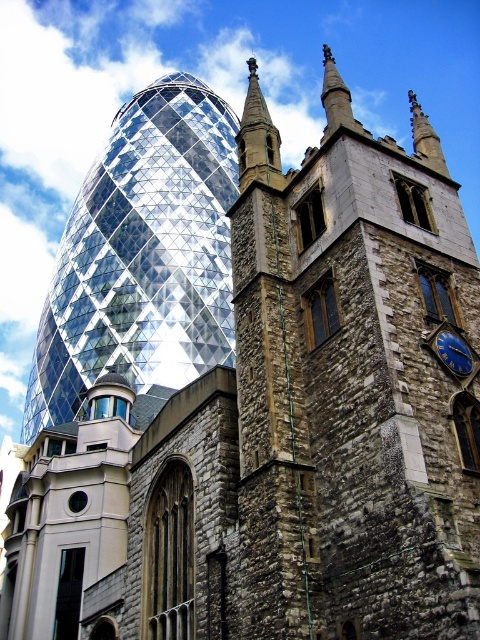
Question: Can you confirm if shiny glass tower at upper left is smaller than blue metallic clock at upper right?

Choices:
 (A) yes
 (B) no

Answer: (B)

Question: Which point appears farthest from the camera in this image?

Choices:
 (A) (274, 179)
 (B) (459, 348)
 (C) (64, 340)

Answer: (C)

Question: Considering the relative positions of shiny glass tower at upper left and blue metallic clock at upper right in the image provided, where is shiny glass tower at upper left located with respect to blue metallic clock at upper right?

Choices:
 (A) left
 (B) right

Answer: (A)

Question: Estimate the real-world distances between objects in this image. Which object is closer to the green stone spire at upper center?

Choices:
 (A) blue metallic clock at upper right
 (B) shiny glass tower at upper left

Answer: (A)

Question: Does shiny glass tower at upper left have a smaller size compared to blue metallic clock at upper right?

Choices:
 (A) yes
 (B) no

Answer: (B)

Question: Which object appears closest to the camera in this image?

Choices:
 (A) blue metallic clock at upper right
 (B) shiny glass tower at upper left

Answer: (A)